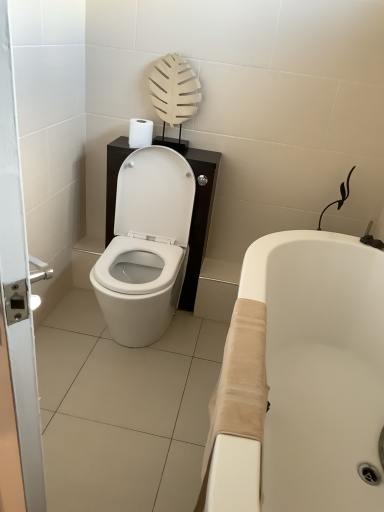
Question: Is the position of white matte toilet paper at upper center less distant than that of white glossy toilet at center?

Choices:
 (A) yes
 (B) no

Answer: (B)

Question: Are white matte toilet paper at upper center and white glossy toilet at center far apart?

Choices:
 (A) yes
 (B) no

Answer: (B)

Question: Is white matte toilet paper at upper center wider than white glossy toilet at center?

Choices:
 (A) no
 (B) yes

Answer: (A)

Question: Does white matte toilet paper at upper center have a greater height compared to white glossy toilet at center?

Choices:
 (A) yes
 (B) no

Answer: (B)

Question: Considering the relative positions of white matte toilet paper at upper center and white glossy toilet at center in the image provided, is white matte toilet paper at upper center to the left of white glossy toilet at center from the viewer's perspective?

Choices:
 (A) no
 (B) yes

Answer: (B)

Question: Considering the relative sizes of white matte toilet paper at upper center and white glossy toilet at center in the image provided, is white matte toilet paper at upper center bigger than white glossy toilet at center?

Choices:
 (A) no
 (B) yes

Answer: (A)

Question: Is white glossy toilet at center oriented towards white glossy door at left?

Choices:
 (A) yes
 (B) no

Answer: (A)

Question: Does white glossy toilet at center touch white glossy door at left?

Choices:
 (A) yes
 (B) no

Answer: (B)

Question: Is white glossy toilet at center to the right of white glossy door at left from the viewer's perspective?

Choices:
 (A) no
 (B) yes

Answer: (B)

Question: Is white glossy door at left at the back of white glossy toilet at center?

Choices:
 (A) no
 (B) yes

Answer: (A)

Question: Would you say white glossy toilet at center is a long distance from white glossy door at left?

Choices:
 (A) yes
 (B) no

Answer: (A)

Question: Can you confirm if white glossy toilet at center is positioned to the left of white glossy door at left?

Choices:
 (A) no
 (B) yes

Answer: (A)

Question: Is beige fabric bathtub at lower right far from white glossy toilet at center?

Choices:
 (A) no
 (B) yes

Answer: (A)